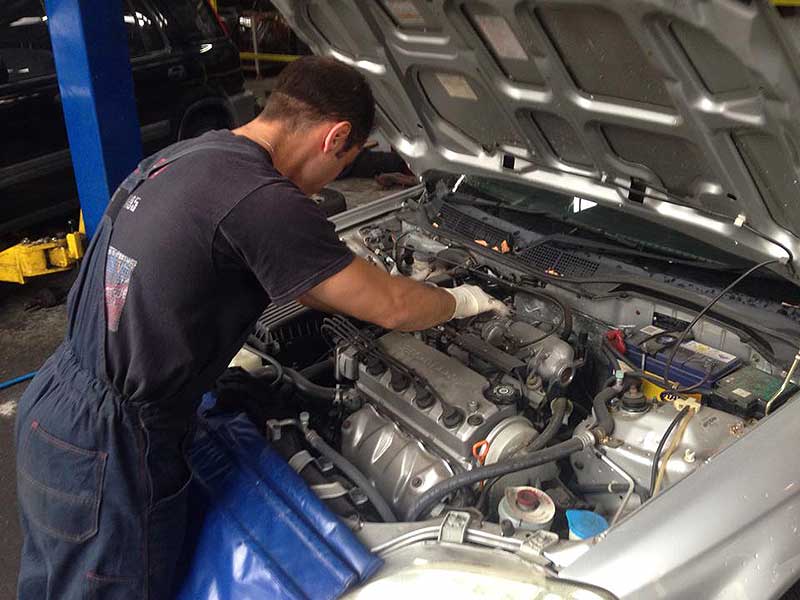
Locate an element on the screen. The height and width of the screenshot is (600, 800). hood is located at coordinates (694, 83).